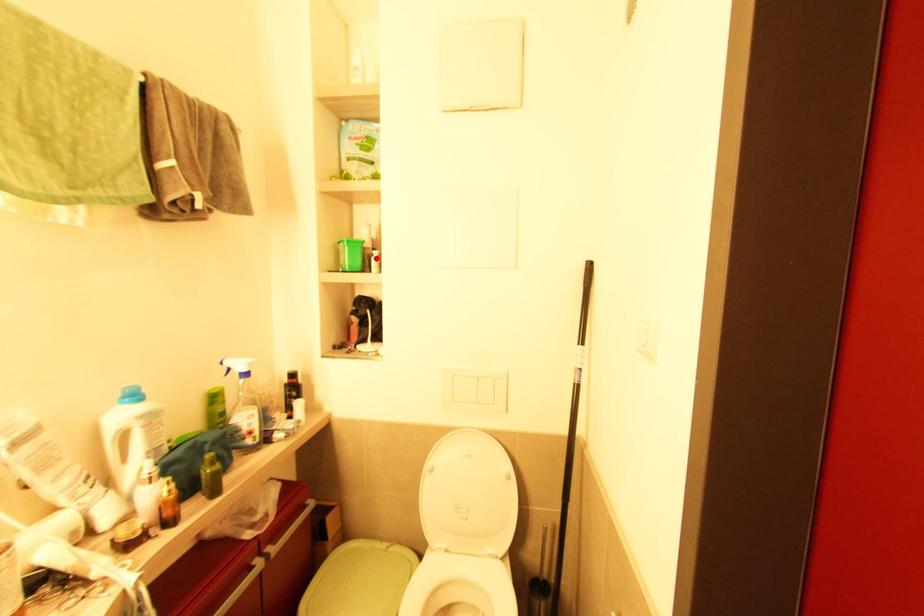
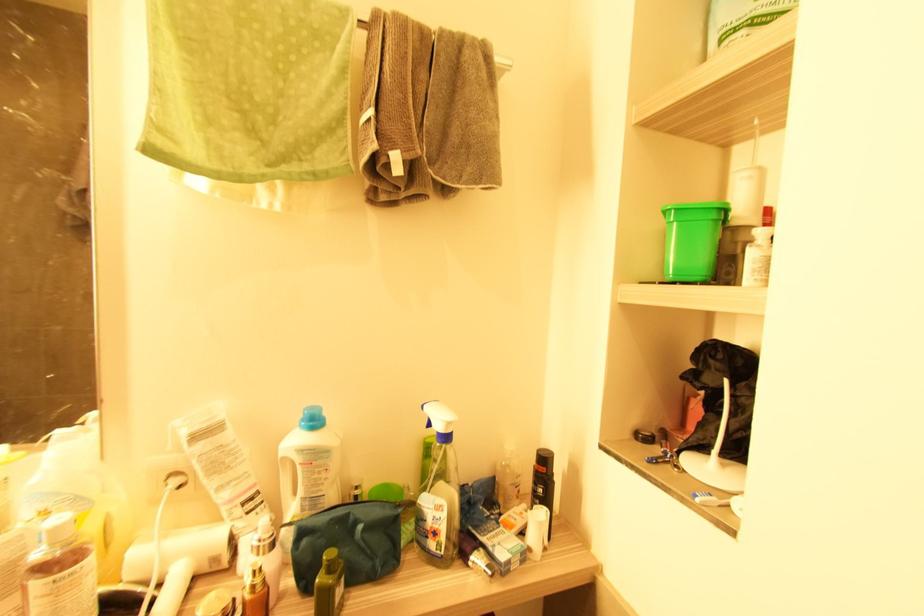
In the second image, find the point that corresponds to the highlighted location in the first image.

(760, 246)